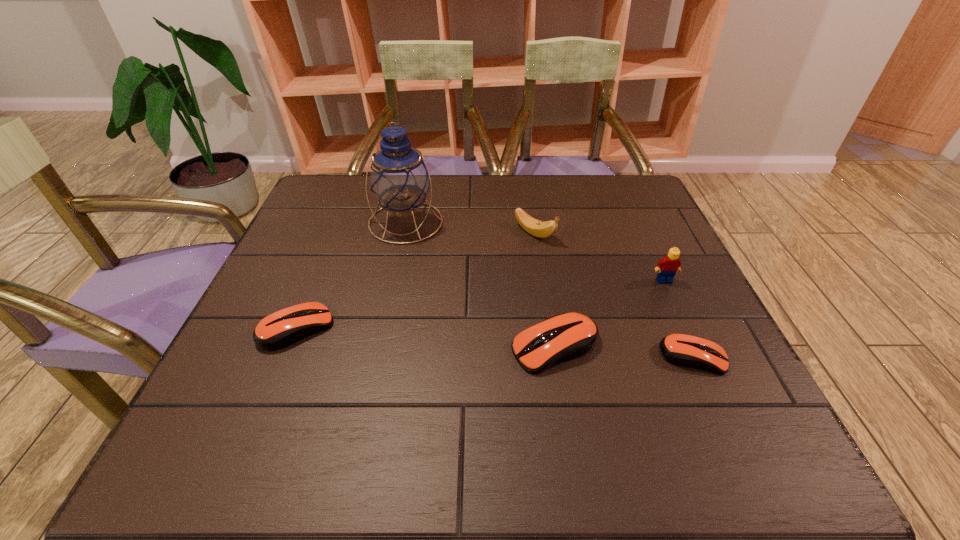
Please point a space for a new mouse_(computer_equipment) to maintain equal intervals. Please provide its 2D coordinates. Your answer should be formatted as a tuple, i.e. [(x, y)], where the tuple contains the x and y coordinates of a point satisfying the conditions above.

[(423, 338)]